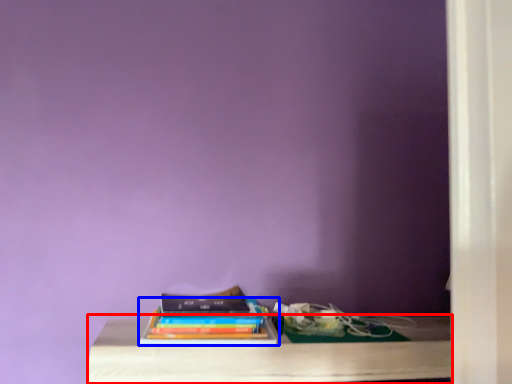
Question: Which point is further to the camera, table (highlighted by a red box) or book (highlighted by a blue box)?

Choices:
 (A) table
 (B) book

Answer: (B)